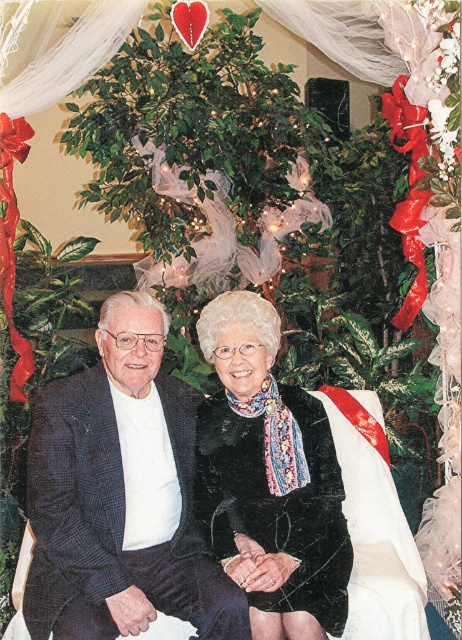
Question: Is dark blue textured suit at center behind black textured scarf at center?

Choices:
 (A) no
 (B) yes

Answer: (A)

Question: Among these points, which one is farthest from the camera?

Choices:
 (A) (247, 506)
 (B) (65, 387)

Answer: (A)

Question: Can you confirm if dark blue textured suit at center is smaller than black textured scarf at center?

Choices:
 (A) yes
 (B) no

Answer: (B)

Question: Considering the relative positions of dark blue textured suit at center and black textured scarf at center in the image provided, where is dark blue textured suit at center located with respect to black textured scarf at center?

Choices:
 (A) below
 (B) above

Answer: (B)